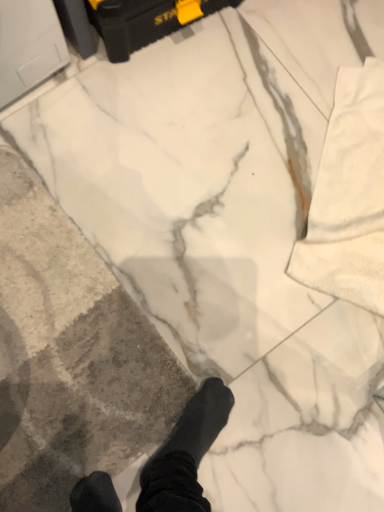
Question: Is gray textured concrete at center completely or partially outside of black plastic toolbox at upper center?

Choices:
 (A) no
 (B) yes

Answer: (B)

Question: Can you confirm if gray textured concrete at center is thinner than black plastic toolbox at upper center?

Choices:
 (A) yes
 (B) no

Answer: (B)

Question: Can you confirm if gray textured concrete at center is positioned to the left of black plastic toolbox at upper center?

Choices:
 (A) yes
 (B) no

Answer: (A)

Question: Does gray textured concrete at center appear on the right side of black plastic toolbox at upper center?

Choices:
 (A) yes
 (B) no

Answer: (B)

Question: From the image's perspective, is gray textured concrete at center below black plastic toolbox at upper center?

Choices:
 (A) no
 (B) yes

Answer: (B)

Question: Considering the relative sizes of gray textured concrete at center and black plastic toolbox at upper center in the image provided, is gray textured concrete at center shorter than black plastic toolbox at upper center?

Choices:
 (A) yes
 (B) no

Answer: (A)

Question: Considering the relative sizes of black plastic toolbox at upper center and gray textured concrete at center in the image provided, is black plastic toolbox at upper center shorter than gray textured concrete at center?

Choices:
 (A) no
 (B) yes

Answer: (A)

Question: Is black plastic toolbox at upper center further to the viewer compared to gray textured concrete at center?

Choices:
 (A) yes
 (B) no

Answer: (A)

Question: Is black plastic toolbox at upper center to the left of gray textured concrete at center from the viewer's perspective?

Choices:
 (A) yes
 (B) no

Answer: (B)

Question: Is black plastic toolbox at upper center looking in the opposite direction of gray textured concrete at center?

Choices:
 (A) no
 (B) yes

Answer: (A)

Question: Is black plastic toolbox at upper center outside of gray textured concrete at center?

Choices:
 (A) no
 (B) yes

Answer: (B)

Question: Does black plastic toolbox at upper center have a larger size compared to gray textured concrete at center?

Choices:
 (A) no
 (B) yes

Answer: (B)

Question: Visually, is black plastic toolbox at upper center positioned to the left or to the right of gray textured concrete at center?

Choices:
 (A) left
 (B) right

Answer: (B)